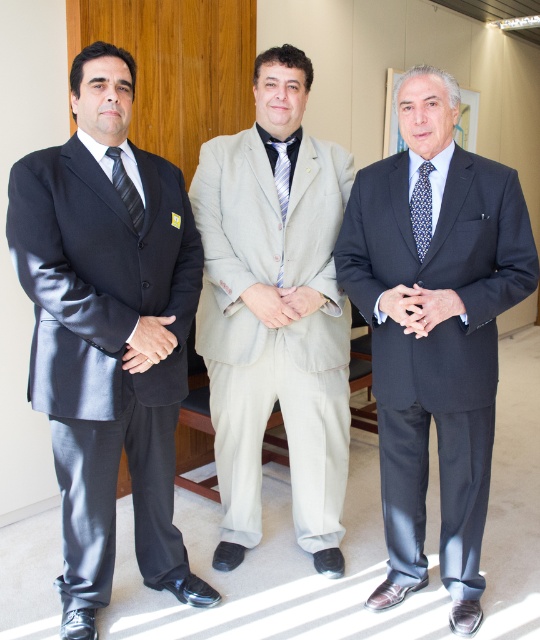
Who is more forward, (430, 170) or (129, 196)?

Positioned in front is point (129, 196).

Is blue dotted tie at center above matte black tie at left?

No, blue dotted tie at center is not above matte black tie at left.

I want to click on blue dotted tie at center, so click(x=421, y=209).

Is point (246, 236) farther from viewer compared to point (125, 208)?

Yes, it is.

Looking at this image, which of these two, beige textured suit at center or matte black tie at left, stands taller?

beige textured suit at center is taller.

Which is in front, point (210, 273) or point (123, 193)?

Point (123, 193) is in front.

Where is `beige textured suit at center`? Image resolution: width=540 pixels, height=640 pixels. beige textured suit at center is located at coordinates (275, 314).

Is point (389, 184) positioned before point (204, 330)?

Yes, point (389, 184) is in front of point (204, 330).

Can you confirm if matte black suit at center is thinner than beige textured suit at center?

No, matte black suit at center is not thinner than beige textured suit at center.

Which is behind, point (423, 464) or point (232, 173)?

Point (232, 173)

Identify the location of matte black suit at center. (435, 332).